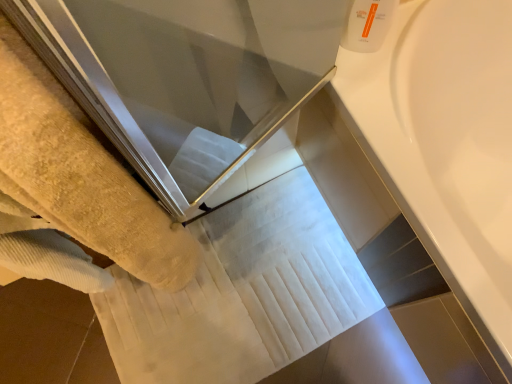
Where is `free space in front of white plastic bottle at upper right`? The width and height of the screenshot is (512, 384). free space in front of white plastic bottle at upper right is located at coordinates (373, 97).